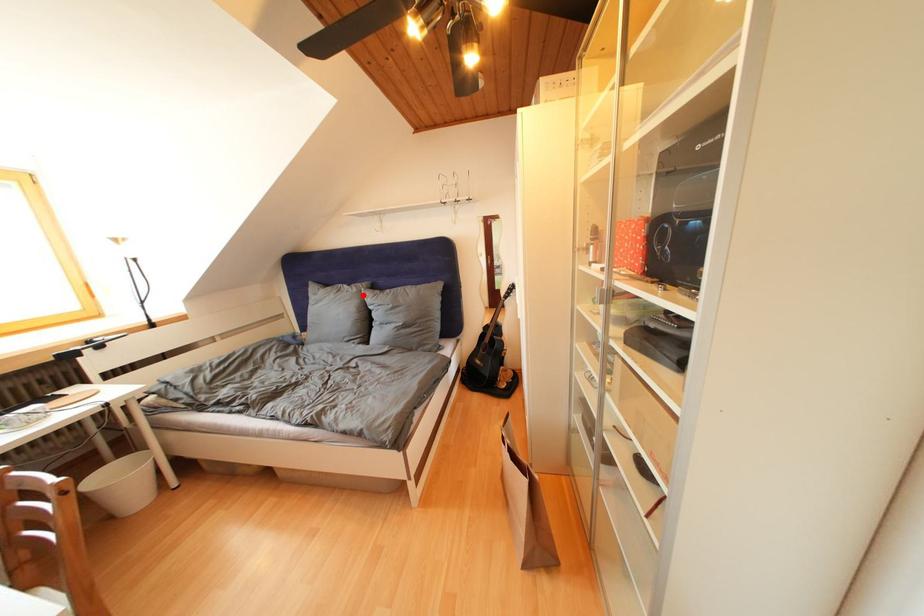
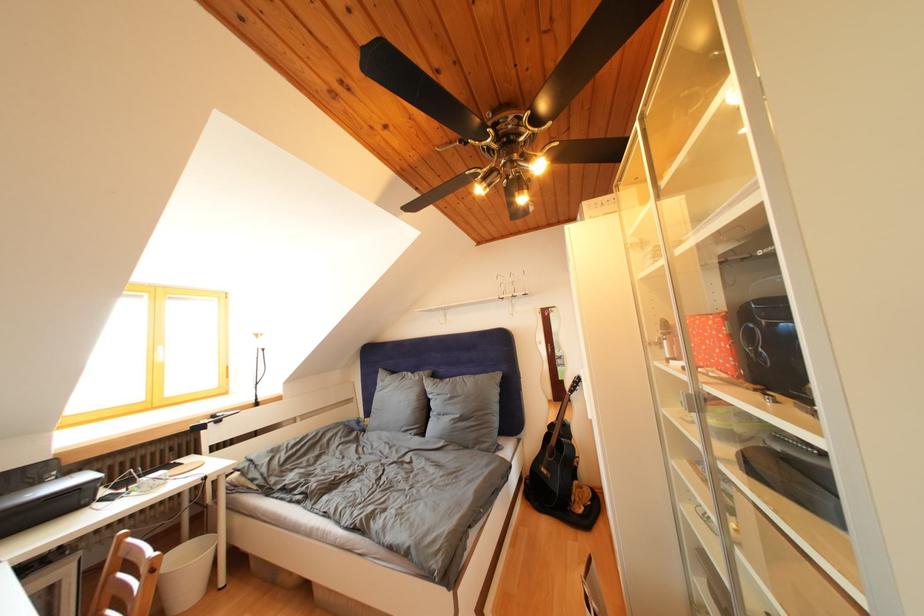
The point at the highlighted location is marked in the first image. Where is the corresponding point in the second image?

(426, 383)